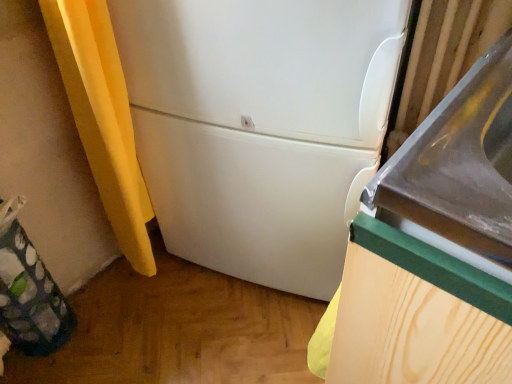
Question: From a real-world perspective, does white glossy sink at center right stand above green fabric bag at lower left?

Choices:
 (A) no
 (B) yes

Answer: (B)

Question: From the image's perspective, is white glossy sink at center right above green fabric bag at lower left?

Choices:
 (A) yes
 (B) no

Answer: (A)

Question: Does white glossy sink at center right have a larger size compared to green fabric bag at lower left?

Choices:
 (A) yes
 (B) no

Answer: (A)

Question: From the image's perspective, is white glossy sink at center right beneath green fabric bag at lower left?

Choices:
 (A) yes
 (B) no

Answer: (B)

Question: Does white glossy sink at center right have a smaller size compared to green fabric bag at lower left?

Choices:
 (A) no
 (B) yes

Answer: (A)

Question: Based on their positions, is white matte refrigerator at center located to the left or right of green fabric bag at lower left?

Choices:
 (A) left
 (B) right

Answer: (B)

Question: From the image's perspective, is white matte refrigerator at center positioned above or below green fabric bag at lower left?

Choices:
 (A) below
 (B) above

Answer: (B)

Question: From a real-world perspective, relative to green fabric bag at lower left, is white matte refrigerator at center vertically above or below?

Choices:
 (A) above
 (B) below

Answer: (A)

Question: Is white matte refrigerator at center taller or shorter than green fabric bag at lower left?

Choices:
 (A) short
 (B) tall

Answer: (B)

Question: Is green fabric bag at lower left bigger or smaller than white matte refrigerator at center?

Choices:
 (A) big
 (B) small

Answer: (B)

Question: From the image's perspective, is green fabric bag at lower left positioned above or below white matte refrigerator at center?

Choices:
 (A) below
 (B) above

Answer: (A)

Question: Is green fabric bag at lower left situated inside white matte refrigerator at center or outside?

Choices:
 (A) outside
 (B) inside

Answer: (A)

Question: In the image, is green fabric bag at lower left positioned in front of or behind white matte refrigerator at center?

Choices:
 (A) behind
 (B) front

Answer: (A)

Question: Based on their sizes in the image, would you say green fabric bag at lower left is bigger or smaller than white glossy sink at center right?

Choices:
 (A) big
 (B) small

Answer: (B)

Question: Is green fabric bag at lower left in front of or behind white glossy sink at center right in the image?

Choices:
 (A) behind
 (B) front

Answer: (A)